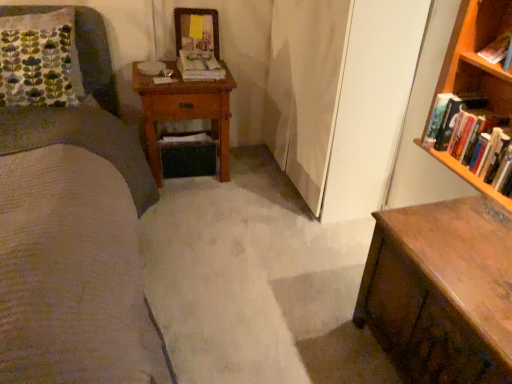
Question: Is hardcover books at right, the 3th book viewed from the top, surrounded by hardcover book at upper right, positioned as the second book in bottom-to-top order?

Choices:
 (A) yes
 (B) no

Answer: (B)

Question: Is hardcover book at upper right, arranged as the 2th book when viewed from the back, bigger than hardcover books at right, the 3th book viewed from the top?

Choices:
 (A) yes
 (B) no

Answer: (B)

Question: From the image's perspective, is hardcover book at upper right, which ranks as the 2th book in top-to-bottom order, beneath hardcover books at right, which appears as the first book when ordered from the bottom?

Choices:
 (A) no
 (B) yes

Answer: (A)

Question: Can you confirm if hardcover book at upper right, which is counted as the 2th book, starting from the left, is shorter than hardcover books at right, the 1th book in the front-to-back sequence?

Choices:
 (A) no
 (B) yes

Answer: (B)

Question: Is hardcover book at upper right, which appears as the second book when viewed from the right, next to hardcover books at right, the 3th book viewed from the top?

Choices:
 (A) yes
 (B) no

Answer: (B)

Question: Does hardcover book at upper right, arranged as the 2th book when viewed from the back, come behind hardcover books at right, which appears as the first book when ordered from the bottom?

Choices:
 (A) yes
 (B) no

Answer: (A)

Question: Is hardcover books at right, which is the 3th book in back-to-front order, shorter than wooden chest of drawers at lower right?

Choices:
 (A) no
 (B) yes

Answer: (B)

Question: Is hardcover books at right, acting as the first book starting from the right, placed right next to wooden chest of drawers at lower right?

Choices:
 (A) yes
 (B) no

Answer: (B)

Question: Is wooden chest of drawers at lower right inside hardcover books at right, the 3th book viewed from the top?

Choices:
 (A) yes
 (B) no

Answer: (B)

Question: Can you confirm if hardcover books at right, which appears as the first book when ordered from the bottom, is thinner than wooden chest of drawers at lower right?

Choices:
 (A) yes
 (B) no

Answer: (A)

Question: From a real-world perspective, is hardcover books at right, the 3th book viewed from the top, over wooden chest of drawers at lower right?

Choices:
 (A) yes
 (B) no

Answer: (A)

Question: Is the position of hardcover books at right, which is the 3th book in back-to-front order, less distant than that of wooden chest of drawers at lower right?

Choices:
 (A) yes
 (B) no

Answer: (B)

Question: Can you confirm if hardcover books at right, placed as the third book when sorted from left to right, is thinner than hardcover book at upper right, the 2th book when ordered from front to back?

Choices:
 (A) yes
 (B) no

Answer: (B)